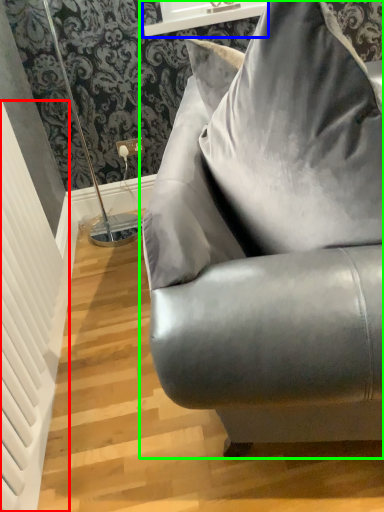
Question: Estimate the real-world distances between objects in this image. Which object is farther from radiator (highlighted by a red box), window sill (highlighted by a blue box) or studio couch (highlighted by a green box)?

Choices:
 (A) window sill
 (B) studio couch

Answer: (A)